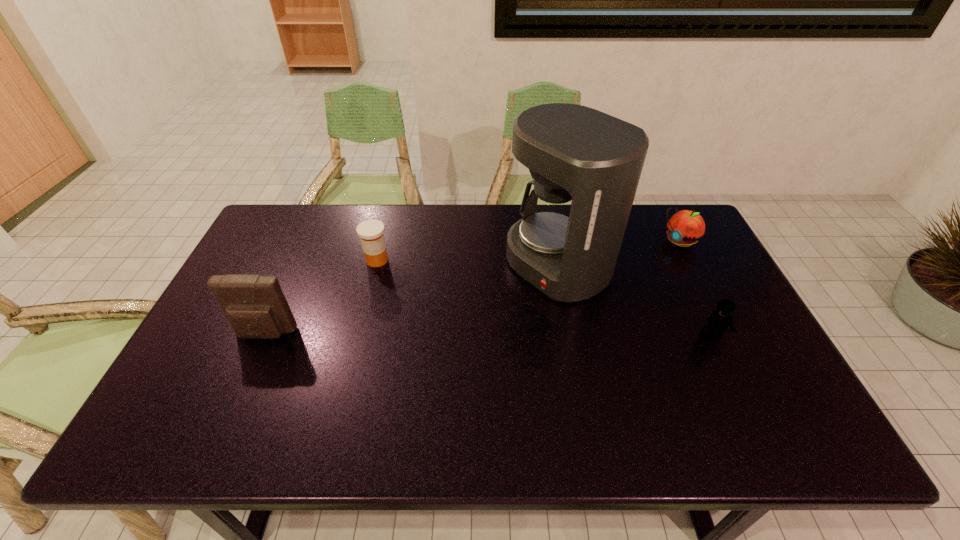
In order to click on the second closest object to the pouch in this screenshot , I will do `click(586, 165)`.

Find the location of a particular element. This screenshot has width=960, height=540. blank area in the image that satisfies the following two spatial constraints: 1. on the front side of the tallest object; 2. on the left side of the medicine is located at coordinates (375, 266).